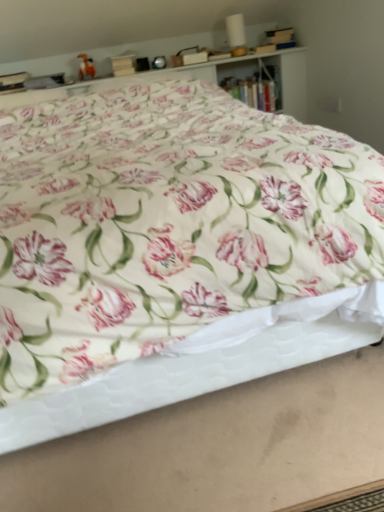
Question: Would you say white quilted mattress at lower center is a long distance from wooden bookshelf at upper center?

Choices:
 (A) yes
 (B) no

Answer: (A)

Question: From the image's perspective, is white quilted mattress at lower center on wooden bookshelf at upper center?

Choices:
 (A) yes
 (B) no

Answer: (B)

Question: Can you confirm if white quilted mattress at lower center is shorter than wooden bookshelf at upper center?

Choices:
 (A) no
 (B) yes

Answer: (B)

Question: Is white quilted mattress at lower center oriented away from wooden bookshelf at upper center?

Choices:
 (A) yes
 (B) no

Answer: (B)

Question: Considering the relative positions of white quilted mattress at lower center and wooden bookshelf at upper center in the image provided, is white quilted mattress at lower center to the right of wooden bookshelf at upper center from the viewer's perspective?

Choices:
 (A) no
 (B) yes

Answer: (A)

Question: Is floral fabric bed at center taller or shorter than wooden bookshelf at upper center?

Choices:
 (A) short
 (B) tall

Answer: (B)

Question: Is floral fabric bed at center bigger or smaller than wooden bookshelf at upper center?

Choices:
 (A) big
 (B) small

Answer: (A)

Question: Is point (142, 122) closer or farther from the camera than point (226, 86)?

Choices:
 (A) farther
 (B) closer

Answer: (B)

Question: In the image, is floral fabric bed at center positioned in front of or behind wooden bookshelf at upper center?

Choices:
 (A) front
 (B) behind

Answer: (A)

Question: Is white quilted mattress at lower center to the left or to the right of wooden bookshelf at upper center in the image?

Choices:
 (A) right
 (B) left

Answer: (B)

Question: From the image's perspective, is white quilted mattress at lower center located above or below wooden bookshelf at upper center?

Choices:
 (A) above
 (B) below

Answer: (B)

Question: Considering their positions, is white quilted mattress at lower center located in front of or behind wooden bookshelf at upper center?

Choices:
 (A) behind
 (B) front

Answer: (B)

Question: Which is correct: white quilted mattress at lower center is inside wooden bookshelf at upper center, or outside of it?

Choices:
 (A) inside
 (B) outside

Answer: (B)

Question: Is point (175, 178) closer or farther from the camera than point (236, 329)?

Choices:
 (A) farther
 (B) closer

Answer: (B)

Question: Based on their positions, is floral fabric bed at center located to the left or right of white quilted mattress at lower center?

Choices:
 (A) right
 (B) left

Answer: (B)